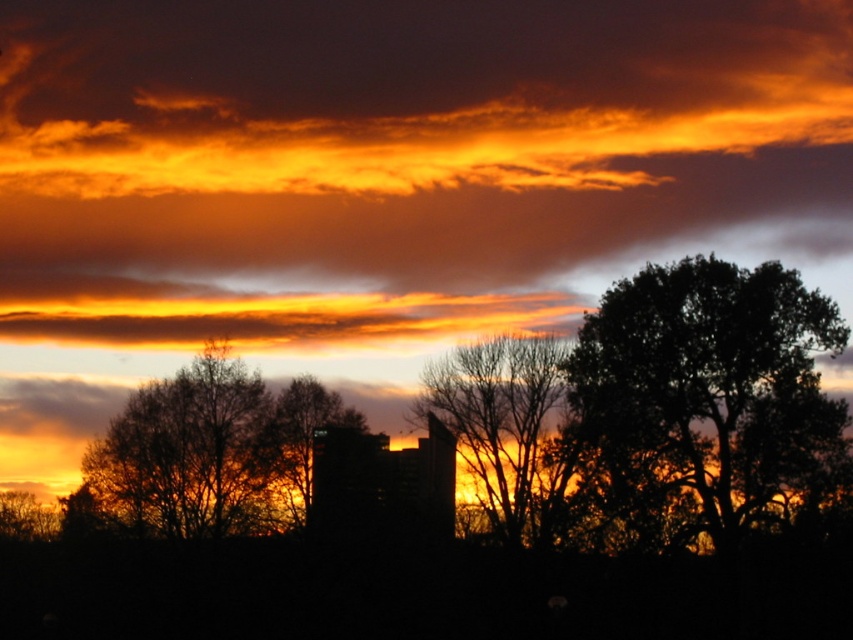
You are standing at the point with coordinates point [292,480] and want to see the sunset. Is the point [476,376] blocking your view of the sunset?

Point [476,376] is behind point [292,480], so it is not blocking your view of the sunset.

You are an architect designing a new garden and want to place a bench between the brown textured tree at center and the bare branches at center. Given the distance between them, can you estimate if a bench that is 1.5 meters long would fit comfortably between them?

The brown textured tree at center and bare branches at center are 15.07 meters apart from each other. A bench that is 1.5 meters long would easily fit comfortably between them since the distance is significantly larger than the bench length.

You are standing in front of the sunset scene and want to take a photo. You notice two points in the image labeled as point 1 at coordinates point (x=178, y=532) and point 2 at coordinates point (x=318, y=413). Which point is closer to your camera lens?

Point (x=178, y=532) is closer to the camera than point (x=318, y=413).